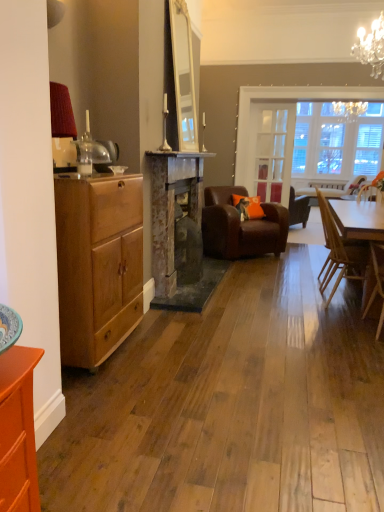
What are the coordinates of `brown leather armchair at center, the first chair in the back-to-front sequence` in the screenshot? It's located at (298, 209).

I want to click on matte wood chest of drawers at left, so click(98, 265).

What do you see at coordinates (248, 207) in the screenshot?
I see `orange fabric pillow at center` at bounding box center [248, 207].

You are a GUI agent. You are given a task and a screenshot of the screen. Output one action in this format:
    pyautogui.click(x=<x>, y=<y>)
    Task: Click on the brown leather armchair at center, which ranks as the 4th chair in front-to-back order
    The image size is (384, 512).
    Given the screenshot: What is the action you would take?
    pyautogui.click(x=298, y=209)

Choose the correct answer: Is brown leather armchair at center, which ranks as the 2th chair in back-to-front order, inside matte wood chest of drawers at left or outside it?

brown leather armchair at center, which ranks as the 2th chair in back-to-front order, is outside matte wood chest of drawers at left.

From the image's perspective, is brown leather armchair at center, which ranks as the 2th chair in back-to-front order, located above matte wood chest of drawers at left?

Correct, brown leather armchair at center, which ranks as the 2th chair in back-to-front order, appears higher than matte wood chest of drawers at left in the image.

From a real-world perspective, is brown leather armchair at center, the 3th chair from the front, physically above matte wood chest of drawers at left?

No, from a real-world perspective, brown leather armchair at center, the 3th chair from the front, is not over matte wood chest of drawers at left

From a real-world perspective, is brown leather armchair at center, which ranks as the 2th chair in back-to-front order, above or below orange fabric pillow at center?

brown leather armchair at center, which ranks as the 2th chair in back-to-front order, is situated lower than orange fabric pillow at center in the real world.

Is brown leather armchair at center, which ranks as the 2th chair in back-to-front order, not close to orange fabric pillow at center?

brown leather armchair at center, which ranks as the 2th chair in back-to-front order, is near orange fabric pillow at center, not far away.

Is brown leather armchair at center, the 3th chair from the front, in front of orange fabric pillow at center?

Yes, it is in front of orange fabric pillow at center.

Is brown leather armchair at center, the 3th chair from the front, facing away from orange fabric pillow at center?

That's right, brown leather armchair at center, the 3th chair from the front, is facing away from orange fabric pillow at center.

Can you confirm if matte wood chest of drawers at left is positioned to the right of rustic stone fireplace at center?

No.

Considering the sizes of matte wood chest of drawers at left and rustic stone fireplace at center in the image, is matte wood chest of drawers at left wider or thinner than rustic stone fireplace at center?

In the image, matte wood chest of drawers at left appears to be wider than rustic stone fireplace at center.

How many degrees apart are the facing directions of matte wood chest of drawers at left and rustic stone fireplace at center?

They differ by 1.12 degrees in their facing directions.

Considering the positions of objects matte wood chest of drawers at left and rustic stone fireplace at center in the image provided, who is behind, matte wood chest of drawers at left or rustic stone fireplace at center?

rustic stone fireplace at center is more distant.

Would you say brown leather armchair at center, the first chair in the back-to-front sequence, is outside light brown wooden chair at right, arranged as the 1th chair when viewed from the front?

That's correct, brown leather armchair at center, the first chair in the back-to-front sequence, is outside of light brown wooden chair at right, arranged as the 1th chair when viewed from the front.

Can you confirm if brown leather armchair at center, the first chair in the back-to-front sequence, is bigger than light brown wooden chair at right, which is counted as the 4th chair, starting from the back?

Correct, brown leather armchair at center, the first chair in the back-to-front sequence, is larger in size than light brown wooden chair at right, which is counted as the 4th chair, starting from the back.

Is brown leather armchair at center, the first chair in the back-to-front sequence, oriented away from light brown wooden chair at right, which is counted as the 4th chair, starting from the back?

No, brown leather armchair at center, the first chair in the back-to-front sequence, is not facing away from light brown wooden chair at right, which is counted as the 4th chair, starting from the back.

Is point (195, 216) in front of point (96, 241)?

No, it is behind (96, 241).

Is rustic stone fireplace at center further to the viewer compared to matte wood chest of drawers at left?

Yes, it is.

Visually, is rustic stone fireplace at center positioned to the left or to the right of matte wood chest of drawers at left?

Based on their positions, rustic stone fireplace at center is located to the right of matte wood chest of drawers at left.

In the scene shown: Can you confirm if rustic stone fireplace at center is bigger than matte wood chest of drawers at left?

Yes, rustic stone fireplace at center is bigger than matte wood chest of drawers at left.

Can you confirm if wooden chair at right, marked as the third chair in a back-to-front arrangement, is thinner than light brown wooden chair at right, which is counted as the 4th chair, starting from the back?

Correct, the width of wooden chair at right, marked as the third chair in a back-to-front arrangement, is less than that of light brown wooden chair at right, which is counted as the 4th chair, starting from the back.

How much distance is there between wooden chair at right, marked as the third chair in a back-to-front arrangement, and light brown wooden chair at right, which is counted as the 4th chair, starting from the back?

A distance of 19.91 inches exists between wooden chair at right, marked as the third chair in a back-to-front arrangement, and light brown wooden chair at right, which is counted as the 4th chair, starting from the back.

Do you think wooden chair at right, marked as the third chair in a back-to-front arrangement, is within light brown wooden chair at right, which is counted as the 4th chair, starting from the back, or outside of it?

wooden chair at right, marked as the third chair in a back-to-front arrangement, lies outside light brown wooden chair at right, which is counted as the 4th chair, starting from the back.

Considering the positions of objects wooden chair at right, which is the 2th chair from front to back, and light brown wooden chair at right, arranged as the 1th chair when viewed from the front, in the image provided, who is more to the left, wooden chair at right, which is the 2th chair from front to back, or light brown wooden chair at right, arranged as the 1th chair when viewed from the front,?

Positioned to the left is wooden chair at right, which is the 2th chair from front to back.

Consider the image. From the image's perspective, is light brown wooden chair at right, arranged as the 1th chair when viewed from the front, below clear glass door at center?

Yes, from the image's perspective, light brown wooden chair at right, arranged as the 1th chair when viewed from the front, is below clear glass door at center.

Considering the relative sizes of light brown wooden chair at right, arranged as the 1th chair when viewed from the front, and clear glass door at center in the image provided, is light brown wooden chair at right, arranged as the 1th chair when viewed from the front, thinner than clear glass door at center?

No.

From a real-world perspective, is light brown wooden chair at right, which is counted as the 4th chair, starting from the back, below clear glass door at center?

Yes, from a real-world perspective, light brown wooden chair at right, which is counted as the 4th chair, starting from the back, is under clear glass door at center.

Is the depth of light brown wooden chair at right, which is counted as the 4th chair, starting from the back, greater than that of clear glass door at center?

No, light brown wooden chair at right, which is counted as the 4th chair, starting from the back, is closer to the viewer.

Find the location of a particular element. The width and height of the screenshot is (384, 512). the 3rd chair behind when counting from the matte wood chest of drawers at left is located at coordinates (240, 227).

Find the location of `the 4th chair directly beneath the orange fabric pillow at center (from a real-world perspective)`. the 4th chair directly beneath the orange fabric pillow at center (from a real-world perspective) is located at coordinates (240, 227).

Looking at the image, which one is located closer to rustic stone fireplace at center, brown leather armchair at center, the 3th chair from the front, or orange fabric pillow at center?

brown leather armchair at center, the 3th chair from the front, is closer to rustic stone fireplace at center.

Estimate the real-world distances between objects in this image. Which object is further from matte wood chest of drawers at left, rustic stone fireplace at center or orange fabric pillow at center?

Based on the image, orange fabric pillow at center appears to be further to matte wood chest of drawers at left.

Which object lies further to the anchor point clear glass door at center, wooden chair at right, which is the 2th chair from front to back, or brown leather armchair at center, the first chair in the back-to-front sequence?

Based on the image, wooden chair at right, which is the 2th chair from front to back, appears to be further to clear glass door at center.

Looking at the image, which one is located closer to rustic stone fireplace at center, brown leather armchair at center, which ranks as the 4th chair in front-to-back order, or wooden chair at right, which is the 2th chair from front to back?

wooden chair at right, which is the 2th chair from front to back, lies closer to rustic stone fireplace at center than the other object.

Estimate the real-world distances between objects in this image. Which object is closer to clear glass door at center, rustic stone fireplace at center or matte wood chest of drawers at left?

Based on the image, rustic stone fireplace at center appears to be nearer to clear glass door at center.

Estimate the real-world distances between objects in this image. Which object is closer to clear glass door at center, orange fabric pillow at center or wooden chair at right, marked as the third chair in a back-to-front arrangement?

The object closer to clear glass door at center is orange fabric pillow at center.

Estimate the real-world distances between objects in this image. Which object is further from orange fabric pillow at center, wooden chair at right, which is the 2th chair from front to back, or brown leather armchair at center, the 3th chair from the front?

The object further to orange fabric pillow at center is wooden chair at right, which is the 2th chair from front to back.

Estimate the real-world distances between objects in this image. Which object is further from brown leather armchair at center, the 3th chair from the front, orange fabric pillow at center or wooden chair at right, which is the 2th chair from front to back?

The object further to brown leather armchair at center, the 3th chair from the front, is wooden chair at right, which is the 2th chair from front to back.

Where is `chair located between light brown wooden chair at right, which is counted as the 4th chair, starting from the back, and brown leather armchair at center, which ranks as the 2th chair in back-to-front order, in the depth direction`? This screenshot has width=384, height=512. chair located between light brown wooden chair at right, which is counted as the 4th chair, starting from the back, and brown leather armchair at center, which ranks as the 2th chair in back-to-front order, in the depth direction is located at coordinates tap(340, 252).

The height and width of the screenshot is (512, 384). I want to click on glass door between matte wood chest of drawers at left and brown leather armchair at center, the first chair in the back-to-front sequence, from front to back, so click(x=273, y=150).

Locate an element on the screen. This screenshot has width=384, height=512. pillow between light brown wooden chair at right, which is counted as the 4th chair, starting from the back, and clear glass door at center, along the z-axis is located at coordinates (248, 207).

This screenshot has width=384, height=512. In order to click on chair positioned between wooden chair at right, which is the 2th chair from front to back, and orange fabric pillow at center from near to far in this screenshot , I will do `click(240, 227)`.